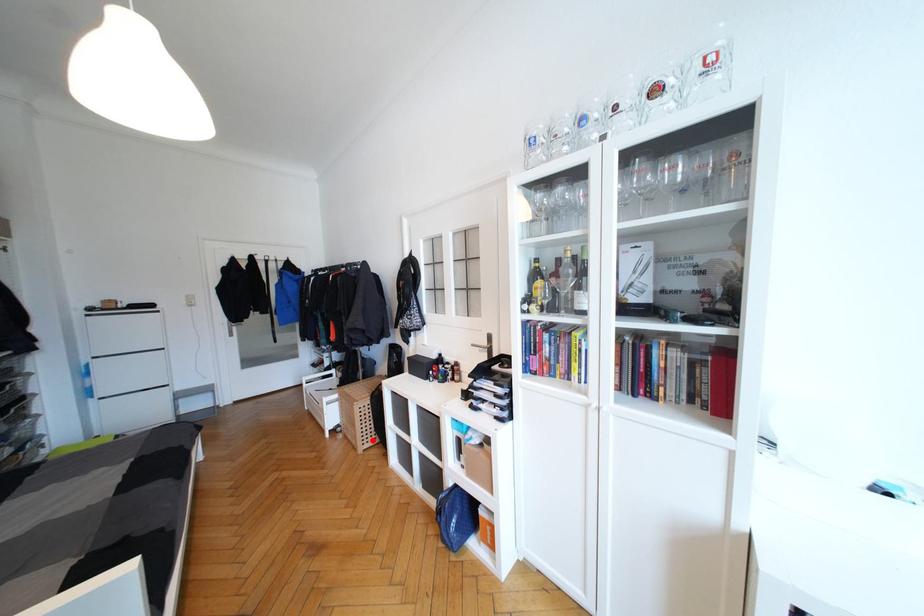
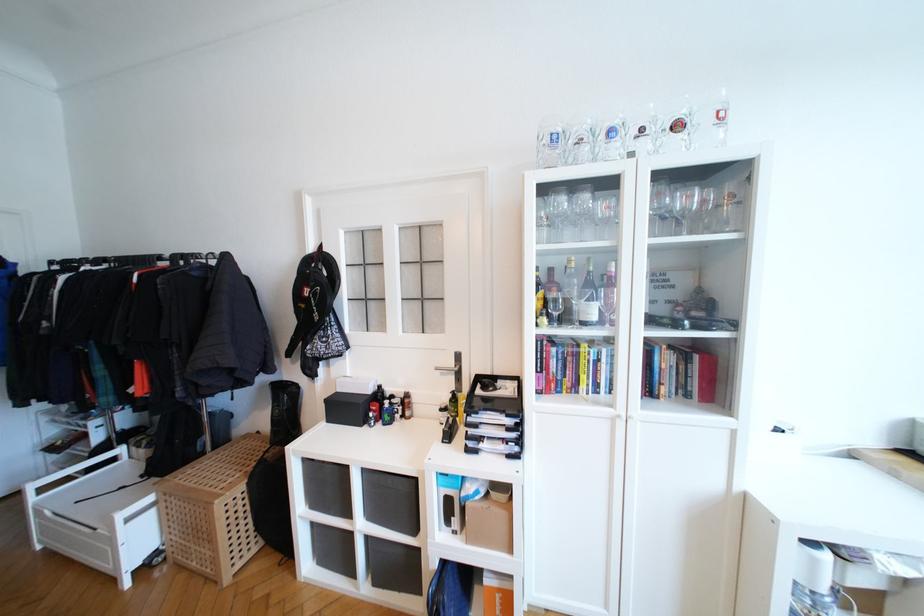
In the second image, find the point that corresponds to the highlighted location in the first image.

(248, 551)